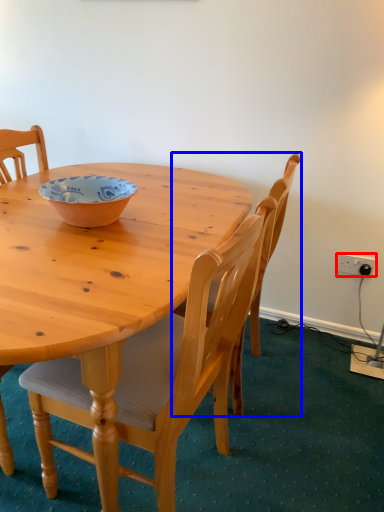
Question: Among these objects, which one is nearest to the camera, power outlet (highlighted by a red box) or chair (highlighted by a blue box)?

Choices:
 (A) power outlet
 (B) chair

Answer: (B)